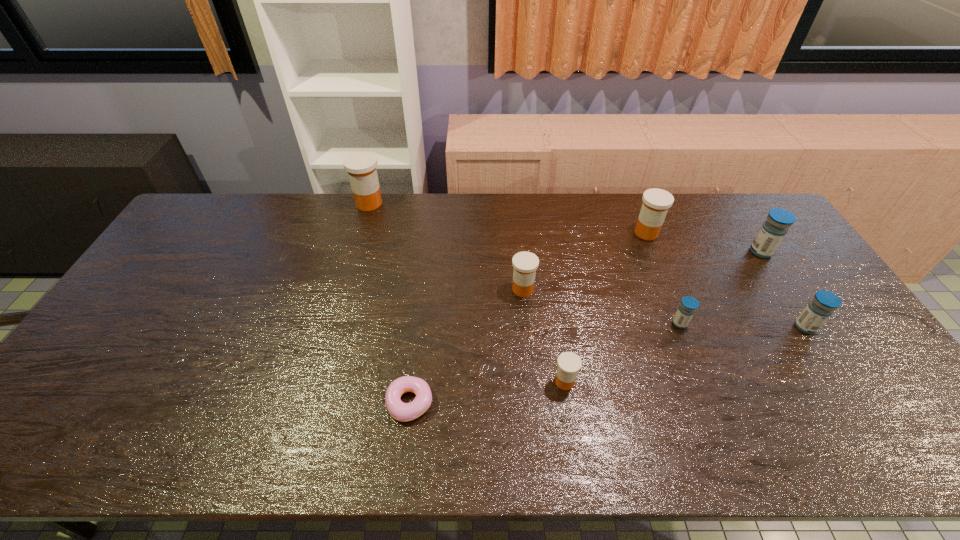
Where is `free spot that satisfies the following two spatial constraints: 1. on the label of the third smallest orange medicine; 2. on the label of the third farthest orange medicine`? The width and height of the screenshot is (960, 540). free spot that satisfies the following two spatial constraints: 1. on the label of the third smallest orange medicine; 2. on the label of the third farthest orange medicine is located at coordinates (669, 289).

The width and height of the screenshot is (960, 540). I want to click on vacant space that satisfies the following two spatial constraints: 1. on the label of the farthest blue medicine; 2. on the right side of the farthest orange medicine, so click(x=355, y=252).

The height and width of the screenshot is (540, 960). Identify the location of blank space that satisfies the following two spatial constraints: 1. on the label of the third smallest orange medicine; 2. on the label of the third object from left to right. (669, 289).

Where is `free point that satisfies the following two spatial constraints: 1. on the label of the farthest orange medicine; 2. on the back side of the seventh object from right to left`? The width and height of the screenshot is (960, 540). free point that satisfies the following two spatial constraints: 1. on the label of the farthest orange medicine; 2. on the back side of the seventh object from right to left is located at coordinates (311, 403).

Where is `free spot that satisfies the following two spatial constraints: 1. on the label of the second farthest medicine; 2. on the right side of the second biggest blue medicine`? This screenshot has height=540, width=960. free spot that satisfies the following two spatial constraints: 1. on the label of the second farthest medicine; 2. on the right side of the second biggest blue medicine is located at coordinates point(684,327).

I want to click on vacant area that satisfies the following two spatial constraints: 1. on the label of the tallest object; 2. on the right side of the shortest object, so (x=311, y=403).

This screenshot has width=960, height=540. In order to click on vacant space that satisfies the following two spatial constraints: 1. on the label of the farthest blue medicine; 2. on the left side of the rightmost orange medicine in this screenshot , I will do `click(654, 252)`.

Find the location of a particular element. The width and height of the screenshot is (960, 540). vacant space that satisfies the following two spatial constraints: 1. on the label of the leftmost orange medicine; 2. on the right side of the second object from left to right is located at coordinates (311, 403).